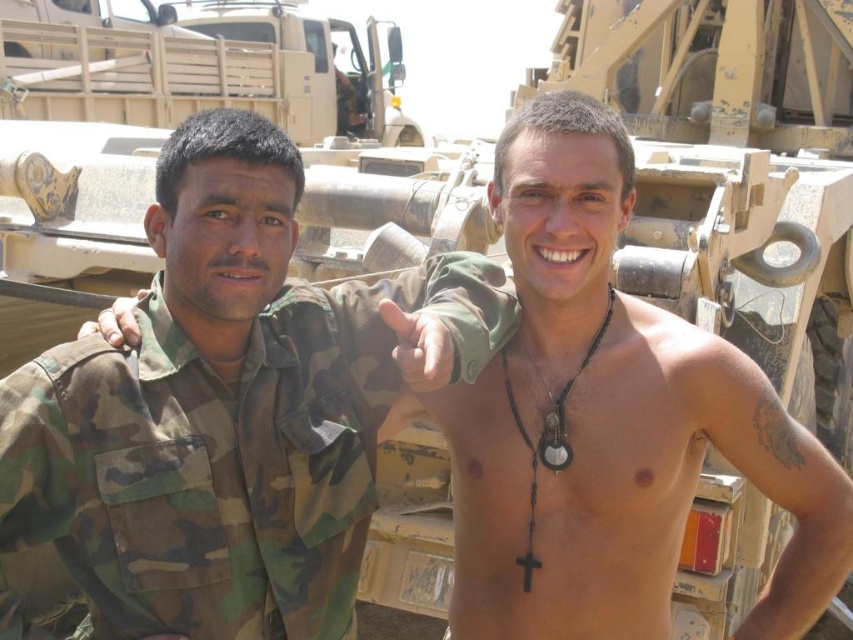
Is point (421, 324) in front of point (115, 317)?

That is True.

Does point (405, 380) come behind point (137, 292)?

No, it is in front of (137, 292).

Is point (392, 314) closer to camera compared to point (103, 314)?

Yes, point (392, 314) is in front of point (103, 314).

Find the location of `matte skin hand at center`. matte skin hand at center is located at coordinates (419, 346).

In the scene shown: Does camouflage fabric shirt at left have a smaller size compared to matte skin hand at center?

Incorrect, camouflage fabric shirt at left is not smaller in size than matte skin hand at center.

Between point (149, 392) and point (415, 316), which one is positioned in front?

Positioned in front is point (415, 316).

Where is `camouflage fabric shirt at left`? camouflage fabric shirt at left is located at coordinates (225, 456).

Is point (311, 534) positioned in front of point (84, 336)?

No, (311, 534) is further to viewer.

Can you confirm if camouflage fabric shirt at left is thinner than camouflage fabric hand at center?

No.

You are a GUI agent. You are given a task and a screenshot of the screen. Output one action in this format:
    pyautogui.click(x=<x>, y=<y>)
    Task: Click on the camouflage fabric shirt at left
    The width and height of the screenshot is (853, 640).
    Given the screenshot: What is the action you would take?
    pyautogui.click(x=225, y=456)

Find the location of a particular element. This screenshot has height=640, width=853. camouflage fabric shirt at left is located at coordinates (225, 456).